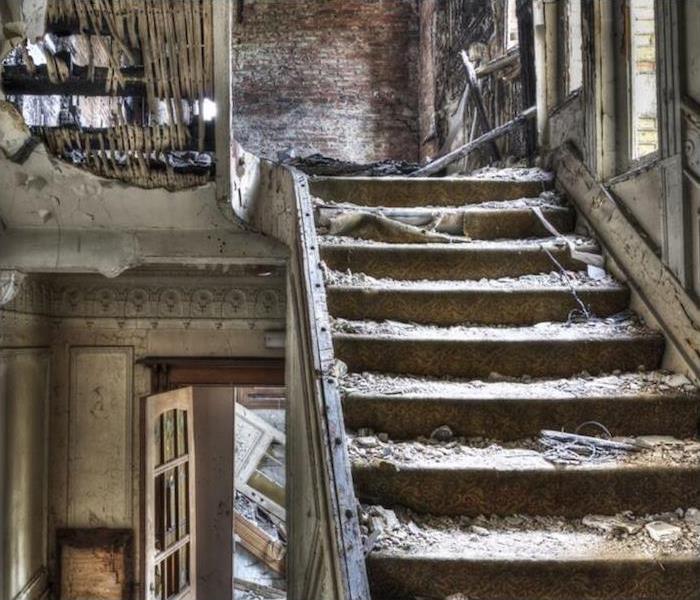
Where is `brick wall`? The height and width of the screenshot is (600, 700). brick wall is located at coordinates (327, 86).